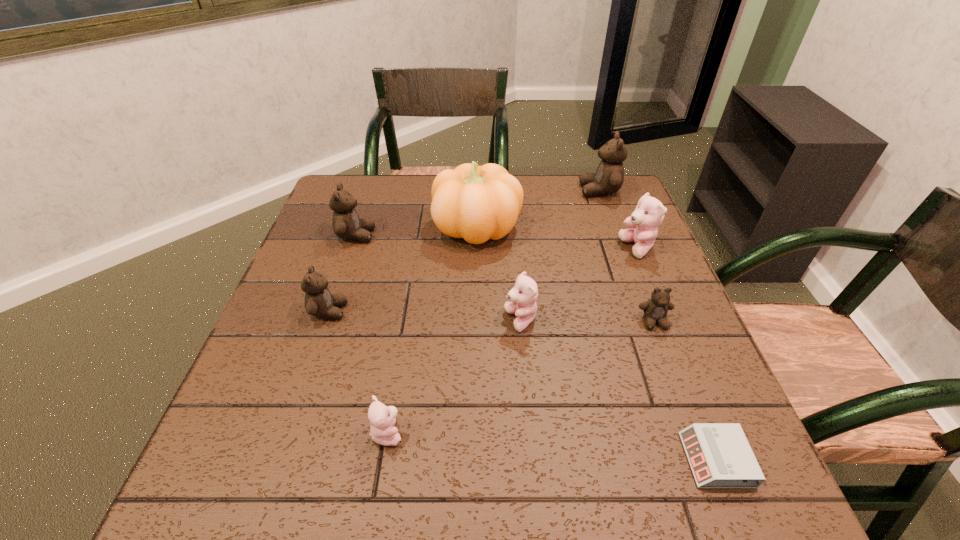
The height and width of the screenshot is (540, 960). In order to click on vacant position in the image that satisfies the following two spatial constraints: 1. on the front side of the pumpkin; 2. on the face of the third biggest brown teddy bear in this screenshot , I will do pos(477,311).

Identify the location of blank area in the image that satisfies the following two spatial constraints: 1. on the face of the biggest brown teddy bear; 2. on the left side of the alarm clock. (698, 460).

The height and width of the screenshot is (540, 960). I want to click on vacant region that satisfies the following two spatial constraints: 1. at the face of the farthest pink teddy bear; 2. on the face of the smallest brown teddy bear, so click(667, 321).

You are a GUI agent. You are given a task and a screenshot of the screen. Output one action in this format:
    pyautogui.click(x=<x>, y=<y>)
    Task: Click on the free point that satisfies the following two spatial constraints: 1. on the face of the shortest object; 2. on the left side of the third biggest brown teddy bear
    The height and width of the screenshot is (540, 960).
    Given the screenshot: What is the action you would take?
    pyautogui.click(x=278, y=460)